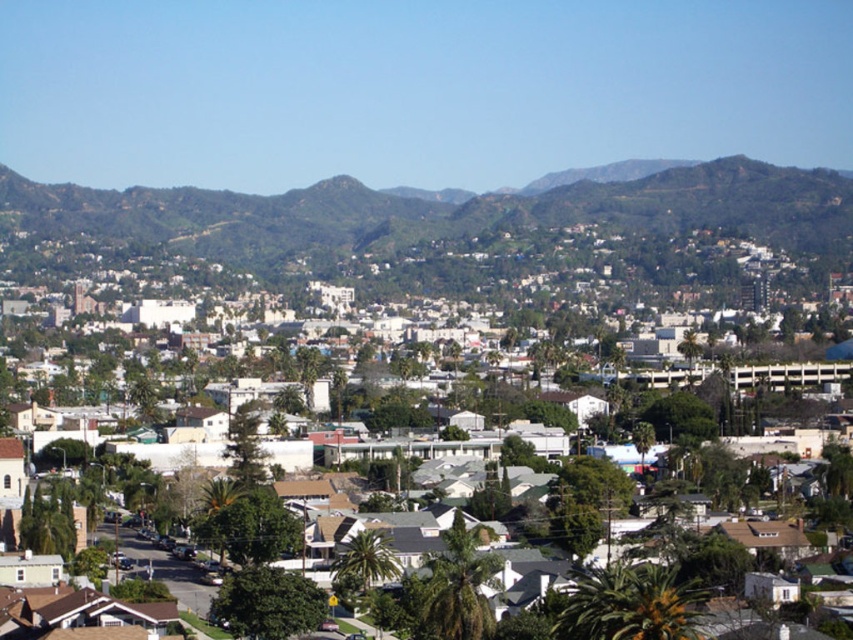
In the scene shown: You are a drone operator flying over a suburban area. Your drone is currently above the white matte houses at center and the green leafy palm tree at center. Which object is directly below the drone if it is hovering at the same altitude as both?

The white matte houses at center is positioned over the green leafy palm tree at center, so the drone would be directly above the white matte houses at center, making the green leafy palm tree at center the one below.

You are a drone operator flying a drone over the suburban area. Your drone is currently above the white matte houses at center. You want to capture a photo of the green leafy palm tree at lower left. Can you fly directly towards the palm tree without going over any obstacles?

The white matte houses at center are further to the viewer than the green leafy palm tree at lower left, meaning the palm tree is closer to the drone. Therefore, the drone can fly directly towards the green leafy palm tree at lower left without needing to go over any obstacles between them.

From the picture: You are a drone operator trying to capture aerial footage of the suburban area. You notice the white matte houses at center and the green leafy palm tree at center. Which object would block the view of the mountains in the background if positioned between them and the camera?

The white matte houses at center would block the view of the mountains in the background since they are much taller than the green leafy palm tree at center, making them more likely to obstruct the view.